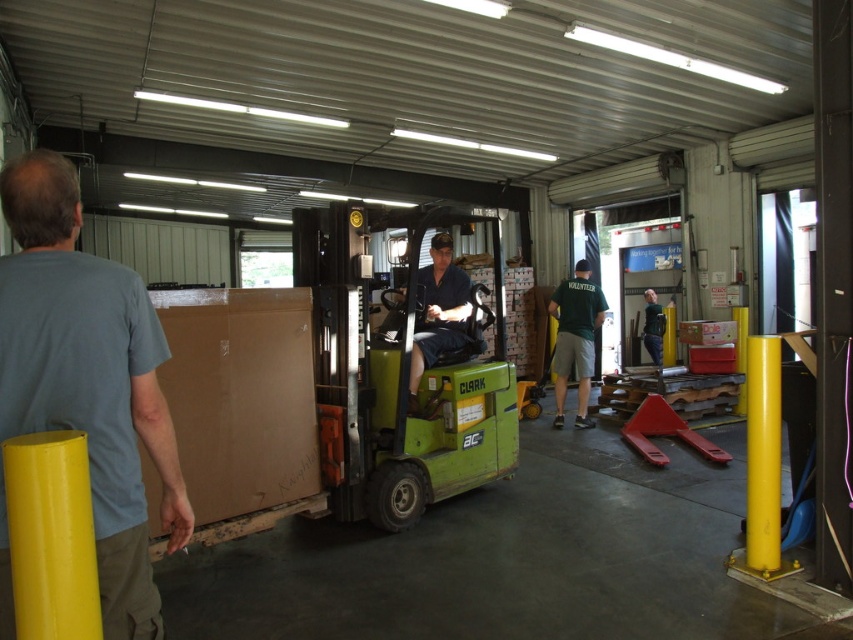
What do you see at coordinates (438, 310) in the screenshot?
I see `matte black shirt at center` at bounding box center [438, 310].

Is matte black shirt at center shorter than green cotton shirt at center?

Yes.

Who is more forward, [434,349] or [572,284]?

Positioned in front is point [434,349].

The width and height of the screenshot is (853, 640). In order to click on matte black shirt at center in this screenshot , I will do `click(438, 310)`.

Does matte black shirt at center have a greater width compared to green fabric shirt at center?

Incorrect, matte black shirt at center's width does not surpass green fabric shirt at center's.

Between point (439, 291) and point (648, 332), which one is positioned in front?

Positioned in front is point (439, 291).

Is point (410, 348) less distant than point (648, 321)?

That is True.

Find the location of a particular element. matte black shirt at center is located at coordinates (438, 310).

From the picture: Does gray cotton shirt at left have a greater height compared to matte black shirt at center?

Yes.

Which is behind, point (134, 461) or point (445, 316)?

The point (445, 316) is more distant.

At what (x,y) coordinates should I click in order to perform the action: click on gray cotton shirt at left. Please return your answer as a coordinate pair (x, y). Looking at the image, I should click on (88, 380).